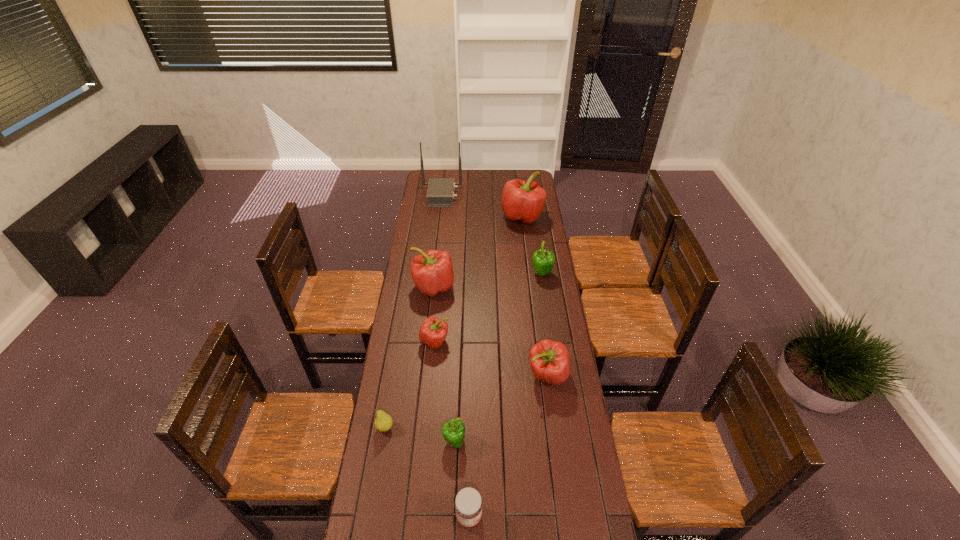
Find the location of a particular element. Image resolution: width=960 pixels, height=540 pixels. vacant space located on the back of the nearer green bell pepper is located at coordinates (456, 396).

Locate an element on the screen. The image size is (960, 540). free space located 0.230m on the right of the pear is located at coordinates pos(458,428).

Where is `vacant space located on the right of the fifth nearest object`? vacant space located on the right of the fifth nearest object is located at coordinates (471, 341).

You are a GUI agent. You are given a task and a screenshot of the screen. Output one action in this format:
    pyautogui.click(x=<x>, y=<y>)
    Task: Click on the vacant space located 0.310m on the right of the red jam
    The image size is (960, 540).
    Given the screenshot: What is the action you would take?
    pyautogui.click(x=582, y=516)

Locate an element on the screen. The image size is (960, 540). object located in the far edge section of the desktop is located at coordinates (440, 193).

The image size is (960, 540). I want to click on router positioned at the left edge, so click(440, 193).

Find the location of `pear present at the left edge`. pear present at the left edge is located at coordinates (383, 422).

I want to click on object that is at the far left corner, so click(x=440, y=193).

Where is `vacant space at the far edge of the desktop`? The image size is (960, 540). vacant space at the far edge of the desktop is located at coordinates (477, 183).

What are the coordinates of `free space at the left edge of the desktop` in the screenshot? It's located at (393, 444).